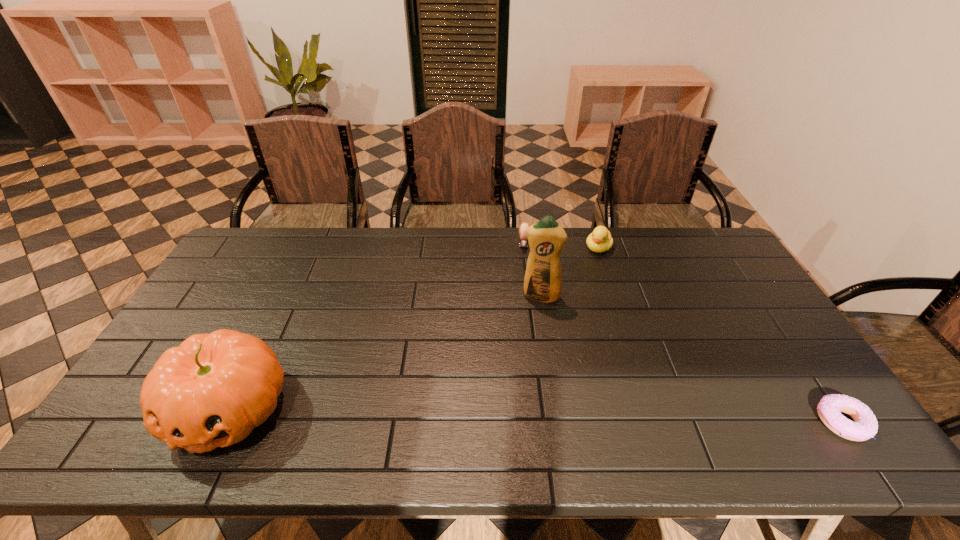
This screenshot has height=540, width=960. Find the location of `free space on the desktop that is between the second tallest object and the doughnut and is positioned on the label of the third nearest object`. free space on the desktop that is between the second tallest object and the doughnut and is positioned on the label of the third nearest object is located at coordinates (516, 415).

In order to click on vacant space on the desktop that is between the pumpkin and the rightmost object and is positioned on the beak of the third tallest object in this screenshot , I will do `click(495, 414)`.

Where is `vacant space on the desktop that is between the pumpkin and the doughnut and is positioned on the front-facing side of the fourth tallest object`? vacant space on the desktop that is between the pumpkin and the doughnut and is positioned on the front-facing side of the fourth tallest object is located at coordinates tap(516, 415).